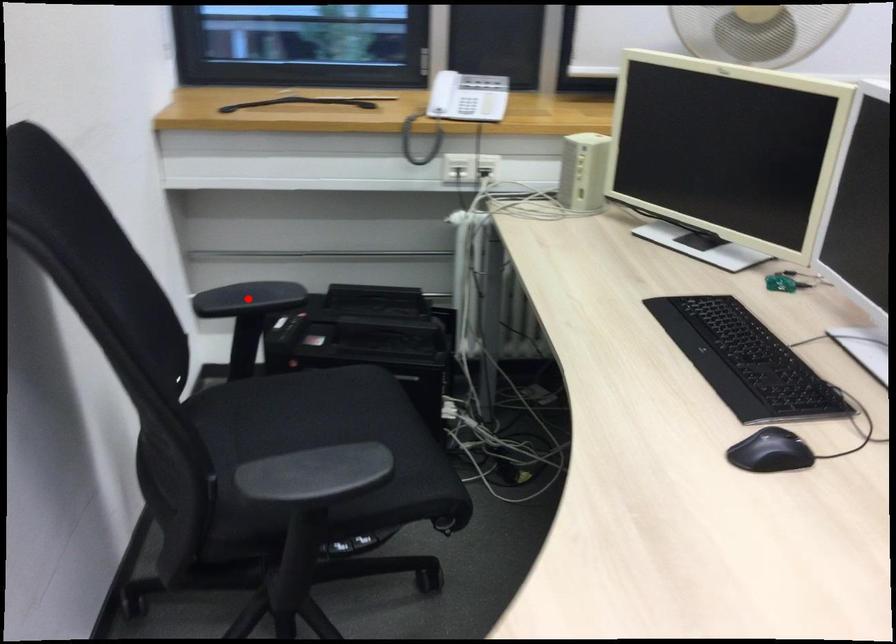
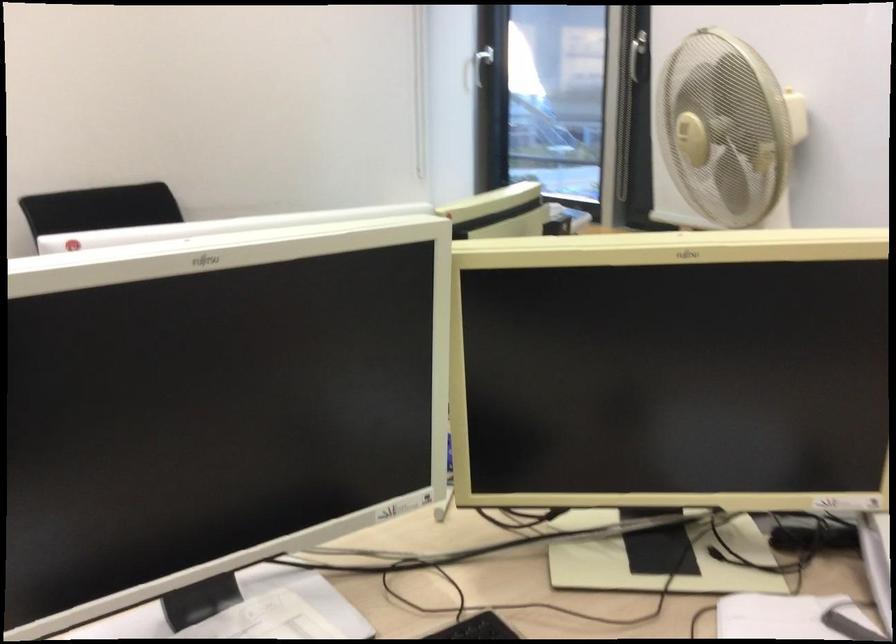
Question: I am providing you with two images of the same scene from different viewpoints. A red point is marked on the first image. Can you still see the location of the red point in image 2?

Choices:
 (A) Yes
 (B) No

Answer: (B)